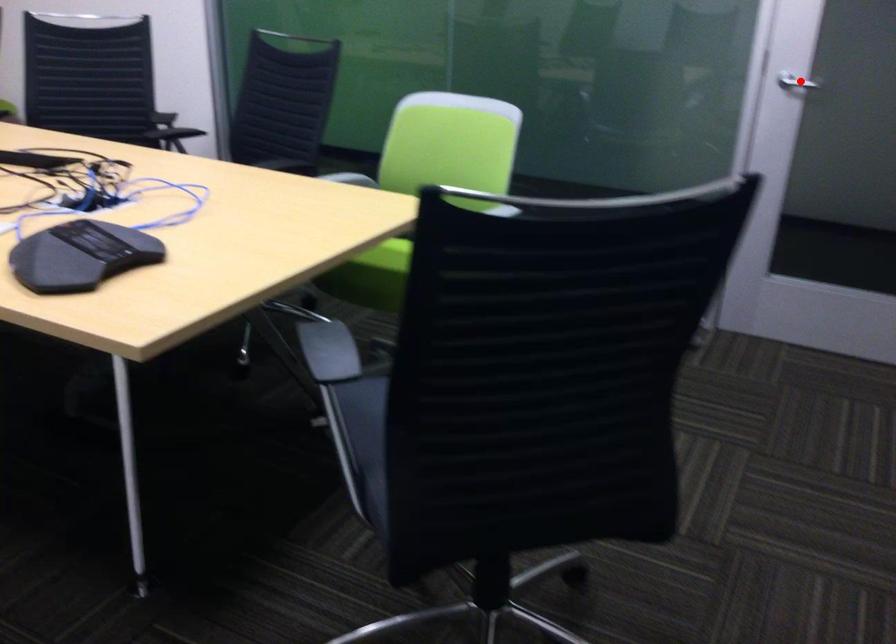
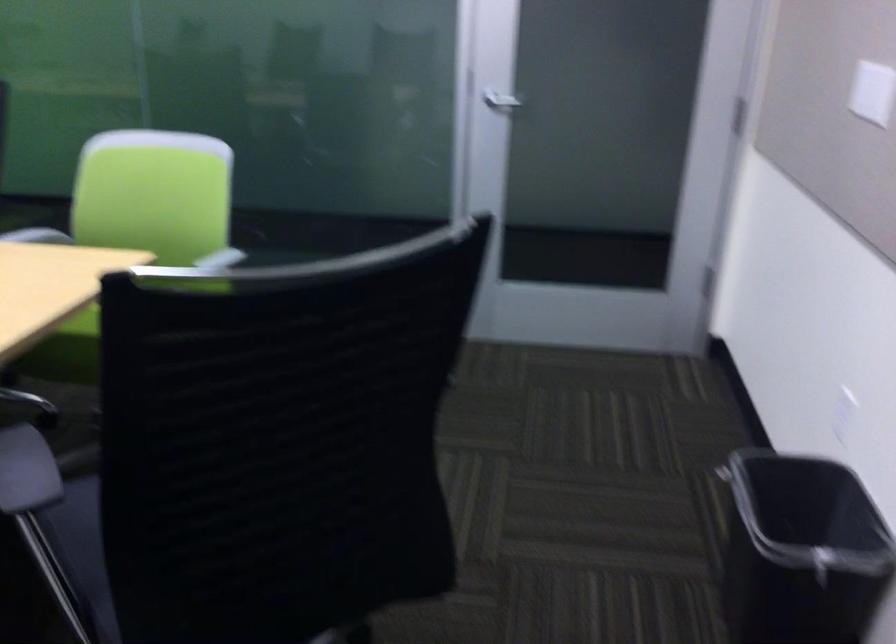
Where in the second image is the point corresponding to the highlighted location from the first image?

(501, 102)